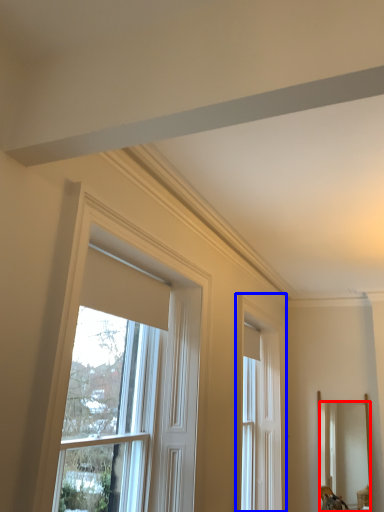
Question: Which of the following is the farthest to the observer, mirror (highlighted by a red box) or window (highlighted by a blue box)?

Choices:
 (A) mirror
 (B) window

Answer: (A)